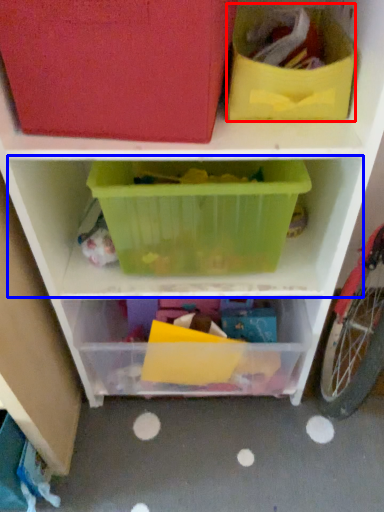
Question: Which object is further to the camera taking this photo, storage box (highlighted by a red box) or shelf (highlighted by a blue box)?

Choices:
 (A) storage box
 (B) shelf

Answer: (B)